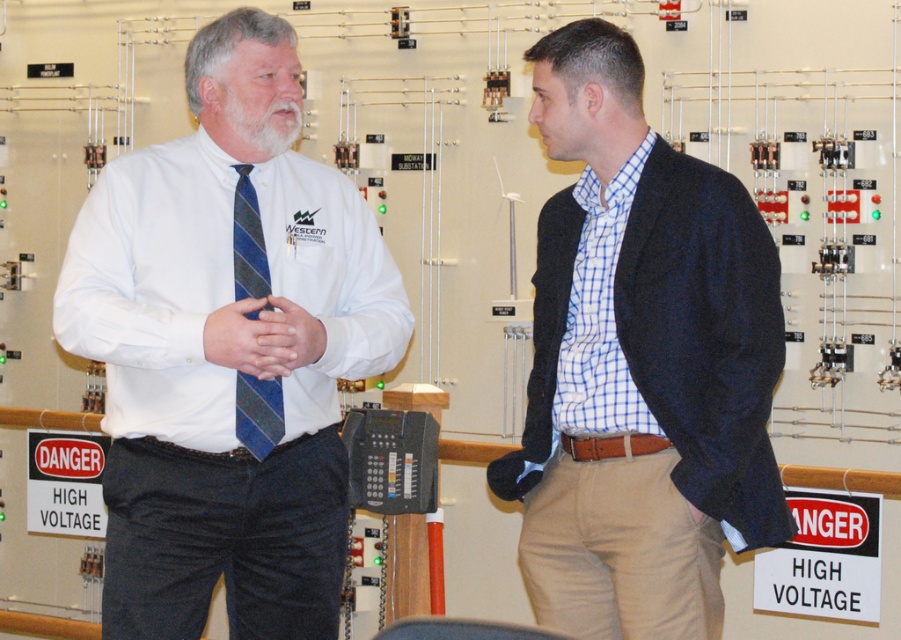
Is white shirt at center below blue checkered shirt at center?

Indeed, white shirt at center is positioned under blue checkered shirt at center.

Which of these two, white shirt at center or blue checkered shirt at center, stands shorter?

blue checkered shirt at center is shorter.

Where is `white shirt at center`? This screenshot has height=640, width=901. white shirt at center is located at coordinates (226, 355).

Who is positioned more to the right, white shirt at center or whitehairbeard at left?

whitehairbeard at left

Can you confirm if white shirt at center is thinner than whitehairbeard at left?

No.

Identify the location of white shirt at center. (226, 355).

The image size is (901, 640). What are the coordinates of `white shirt at center` in the screenshot? It's located at (226, 355).

Based on the photo, is white shirt at center smaller than blue striped tie at center?

No, white shirt at center is not smaller than blue striped tie at center.

Who is taller, white shirt at center or blue striped tie at center?

white shirt at center

Does point (328, 221) come closer to viewer compared to point (256, 278)?

No, it is not.

Locate an element on the screen. This screenshot has height=640, width=901. white shirt at center is located at coordinates (226, 355).